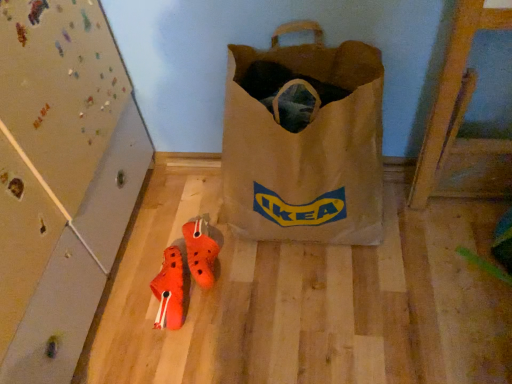
I want to click on vacant region in front of brown paper bag at center, so click(x=327, y=321).